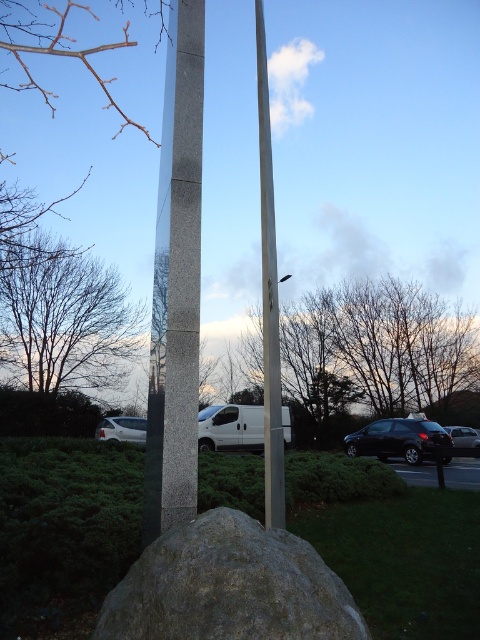
Question: Is gray rough rock at center below polished metal flag pole at center?

Choices:
 (A) yes
 (B) no

Answer: (A)

Question: Does white matte van at center appear under metallic silver car at lower right?

Choices:
 (A) no
 (B) yes

Answer: (A)

Question: Estimate the real-world distances between objects in this image. Which object is farther from the white matte van at lower left?

Choices:
 (A) polished metal flag pole at center
 (B) white matte van at center
 (C) polished granite pole at center

Answer: (C)

Question: Is polished granite pole at center thinner than polished metal flag pole at center?

Choices:
 (A) no
 (B) yes

Answer: (A)

Question: Considering the real-world distances, which object is farthest from the polished granite pole at center?

Choices:
 (A) white matte van at center
 (B) white matte van at lower left
 (C) gray rough rock at center
 (D) shiny black car at lower right

Answer: (D)

Question: Among these objects, which one is nearest to the camera?

Choices:
 (A) gray rough rock at center
 (B) polished metal flag pole at center

Answer: (A)